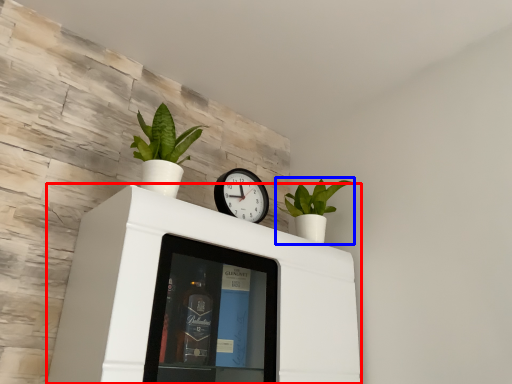
Question: Which object appears closest to the camera in this image, furniture (highlighted by a red box) or houseplant (highlighted by a blue box)?

Choices:
 (A) furniture
 (B) houseplant

Answer: (A)